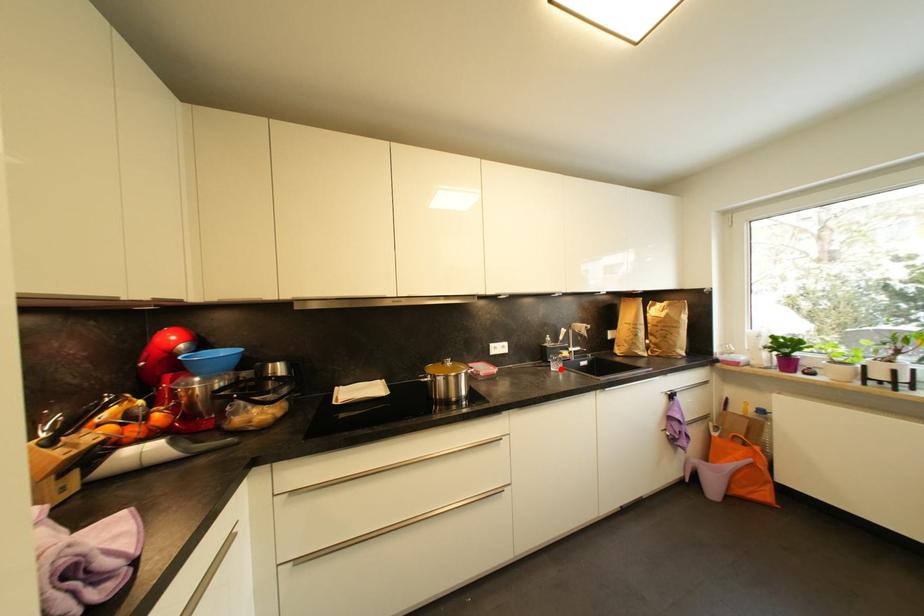
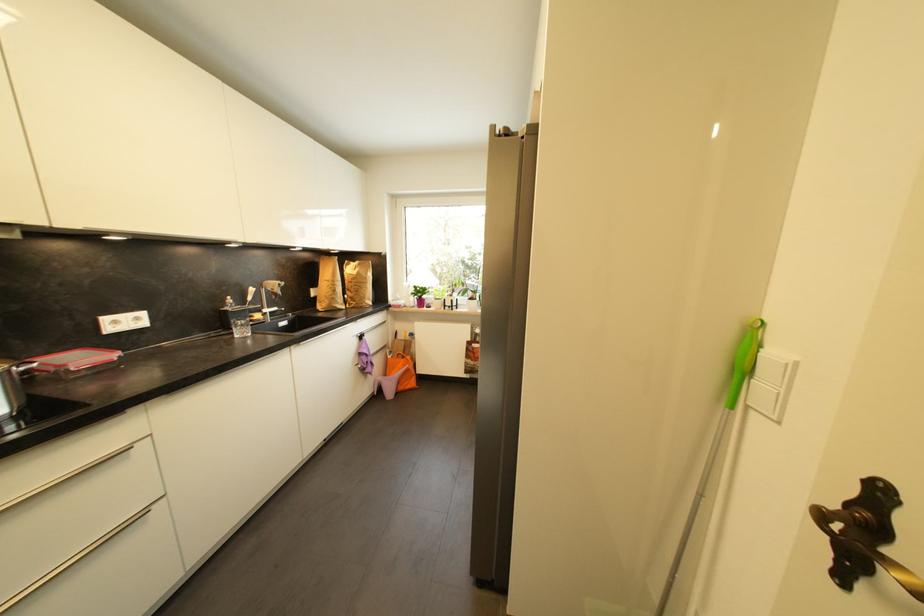
Question: I am providing you with two images of the same scene from different viewpoints. In image1, a red point is highlighted. Considering the same 3D point in image2, which of the following is correct?

Choices:
 (A) It is closer
 (B) It is farther

Answer: (A)